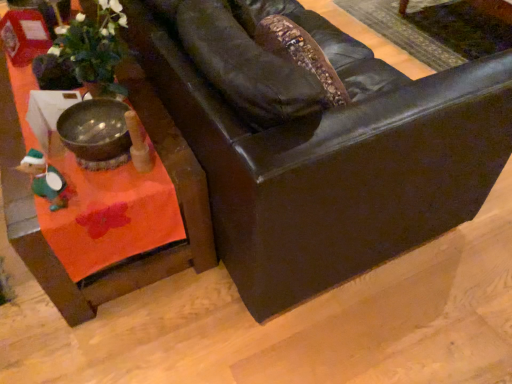
Locate an element on the screen. vacant region to the right of green felt toy at lower left is located at coordinates (110, 195).